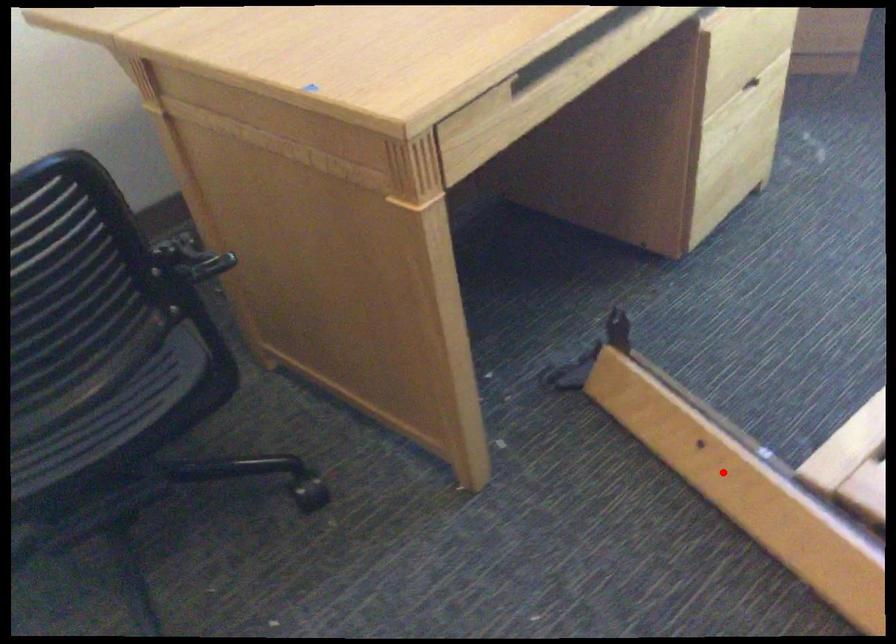
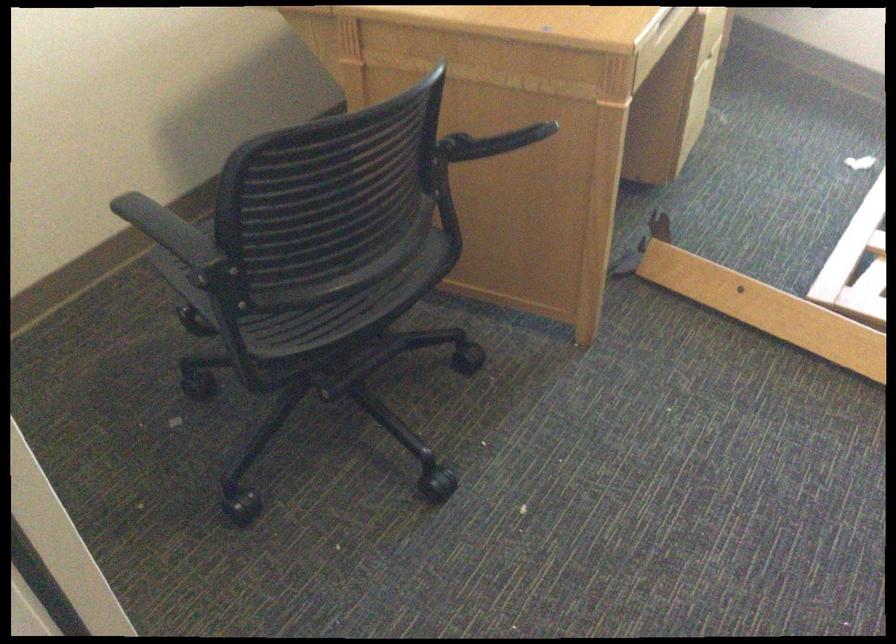
Question: I am providing you with two images of the same scene from different viewpoints. A red point is marked on the first image. Is the red point's position out of view in image 2?

Choices:
 (A) Yes
 (B) No

Answer: (B)